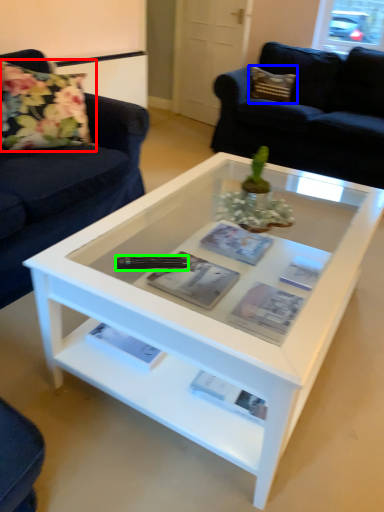
Question: Estimate the real-world distances between objects in this image. Which object is closer to flower (highlighted by a red box), pillow (highlighted by a blue box) or remote (highlighted by a green box)?

Choices:
 (A) pillow
 (B) remote

Answer: (B)